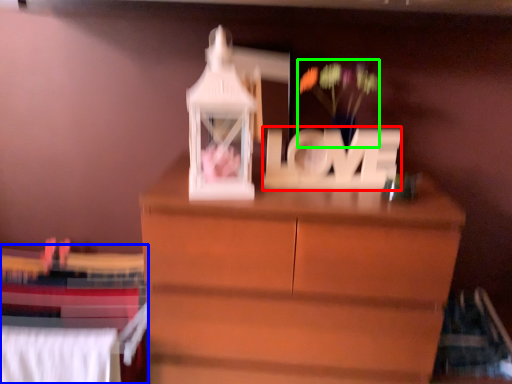
Question: Which object is the farthest from letter (highlighted by a red box)? Choose among these: bed (highlighted by a blue box) or floral arrangement (highlighted by a green box).

Choices:
 (A) bed
 (B) floral arrangement

Answer: (A)